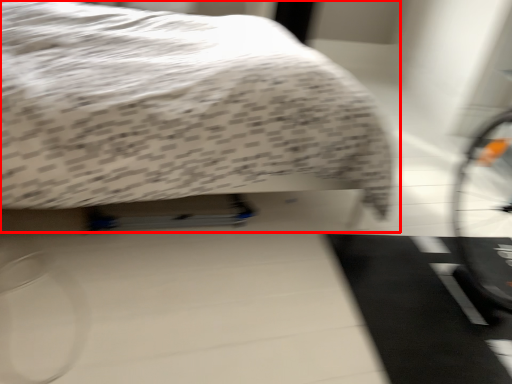
Question: From the image's perspective, considering the relative positions of bed (annotated by the red box) and doormat in the image provided, where is bed (annotated by the red box) located with respect to the staircase?

Choices:
 (A) below
 (B) above

Answer: (B)